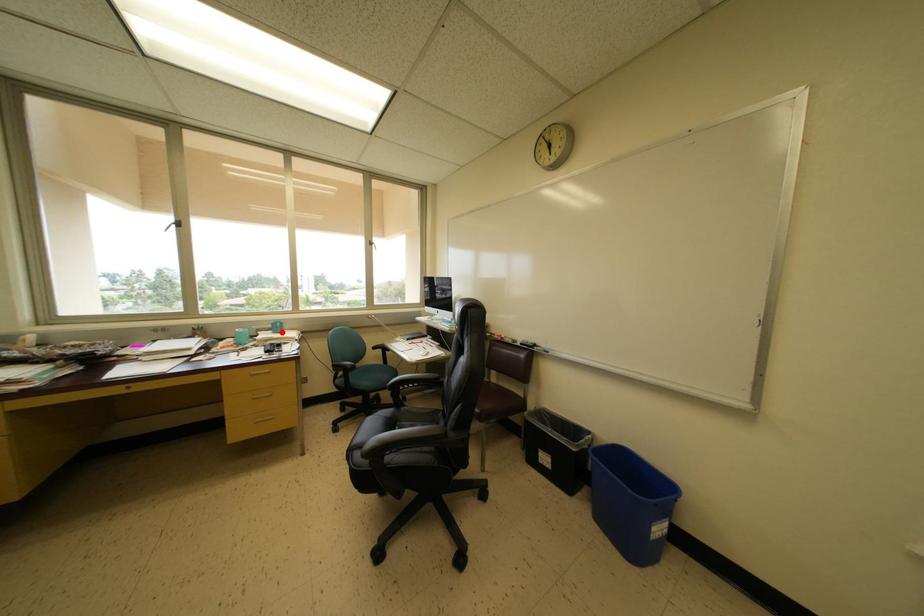
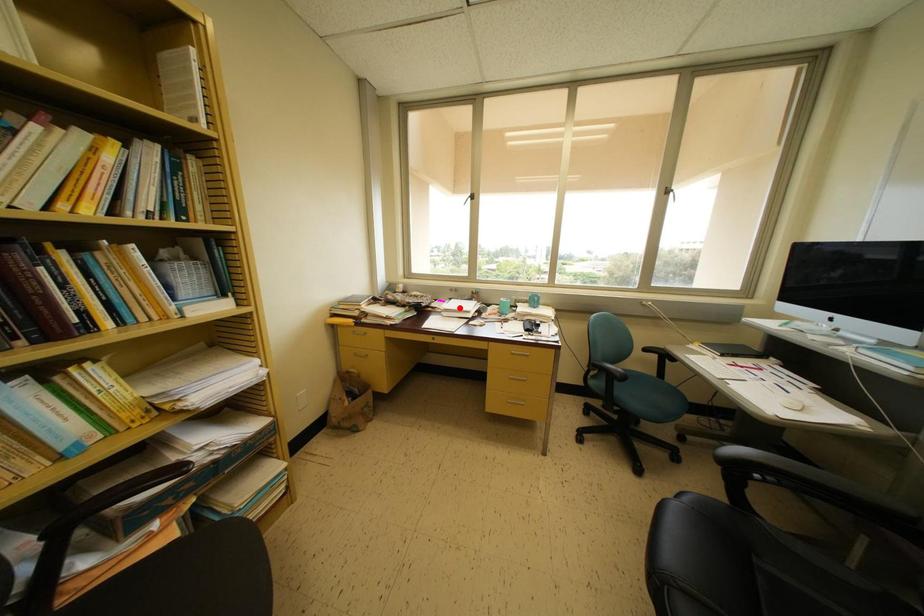
I am providing you with two images of the same scene from different viewpoints. A red point is marked on the first image and another point is marked on the second image. Does the point marked in image1 correspond to the same location as the one in image2?

No